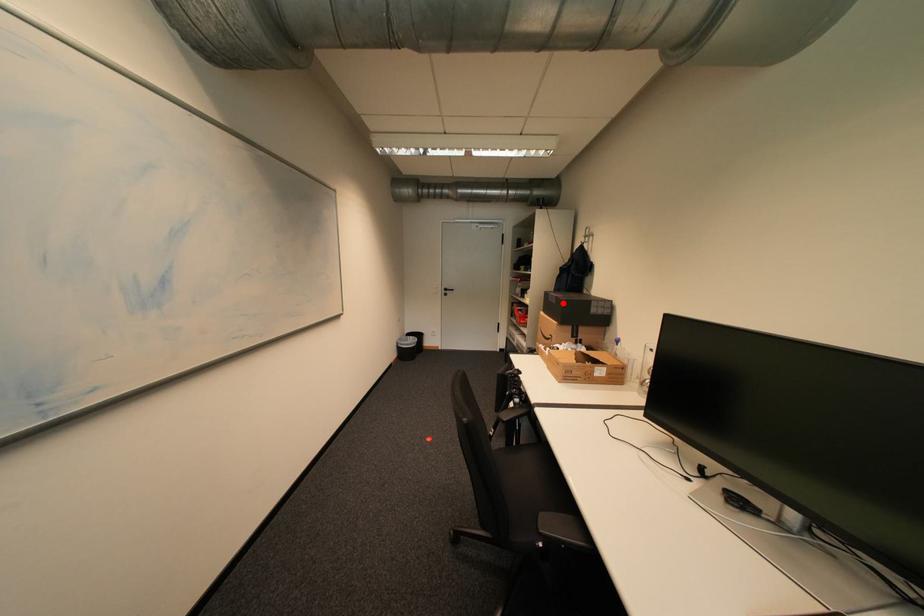
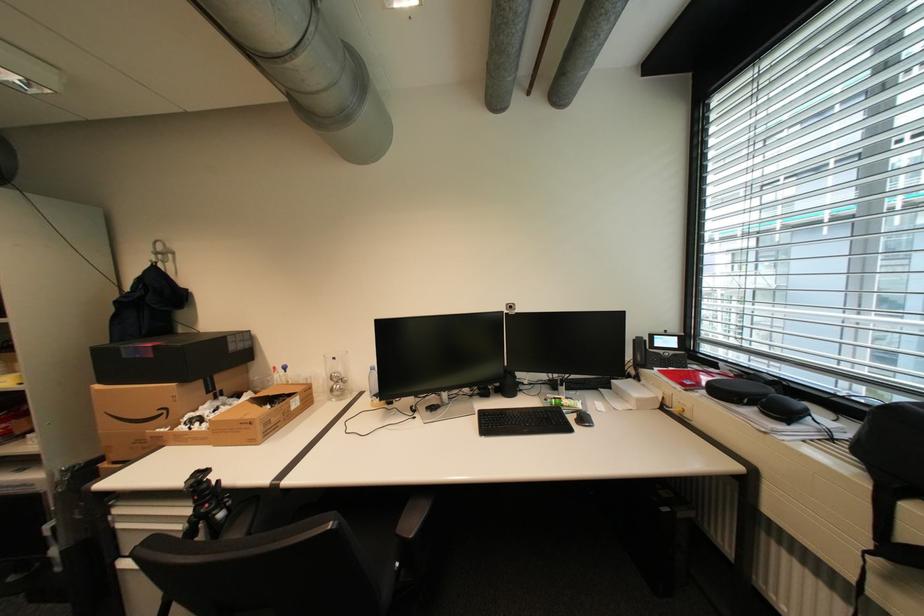
Question: I am providing you with two images of the same scene from different viewpoints. Image1 has a red point marked. In image2, the corresponding 3D location appears at what relative position? Reply with the corresponding letter.

Choices:
 (A) Closer
 (B) Farther

Answer: (B)